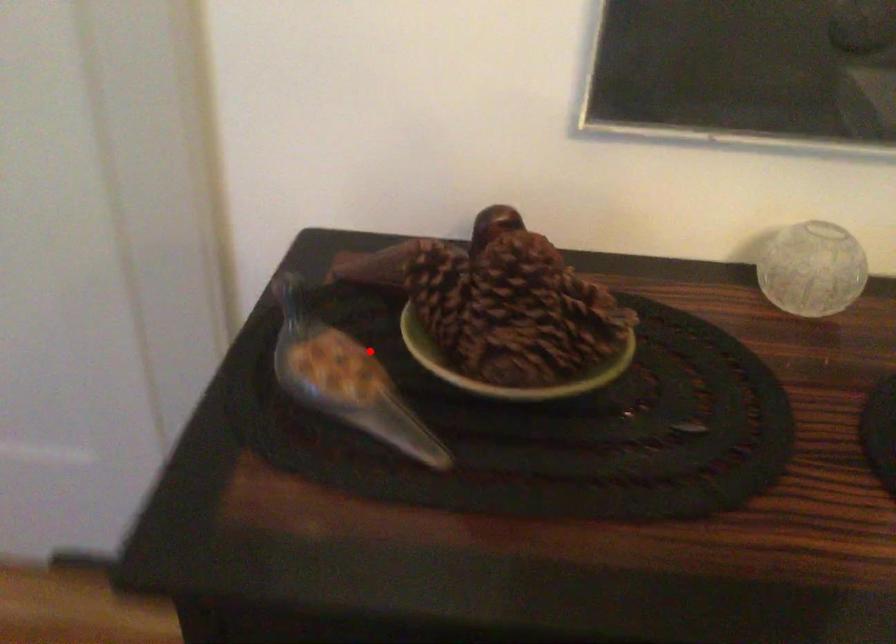
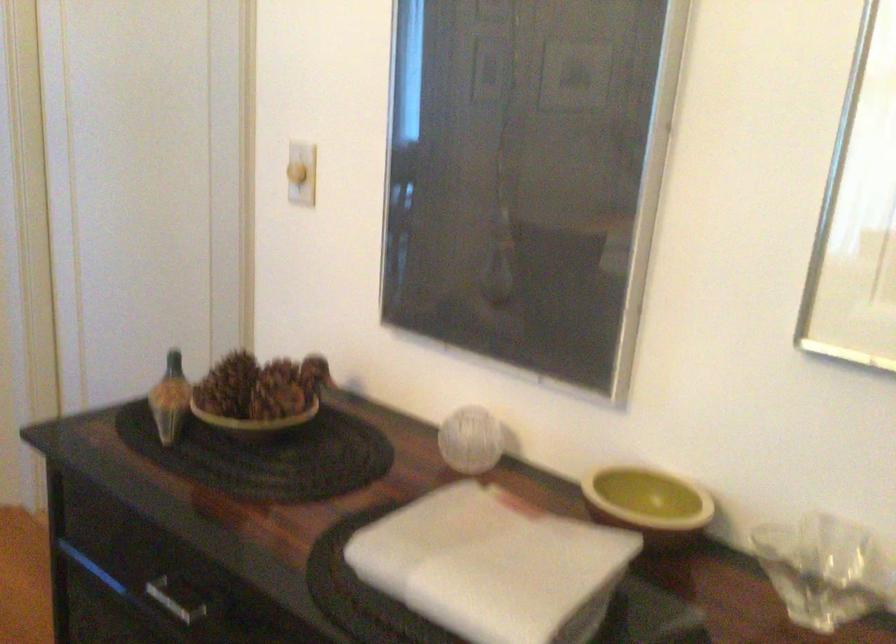
Question: I am providing you with two images of the same scene from different viewpoints. A red point is shown in image1. For the corresponding object point in image2, is it positioned nearer or farther from the camera?

Choices:
 (A) Nearer
 (B) Farther

Answer: (B)